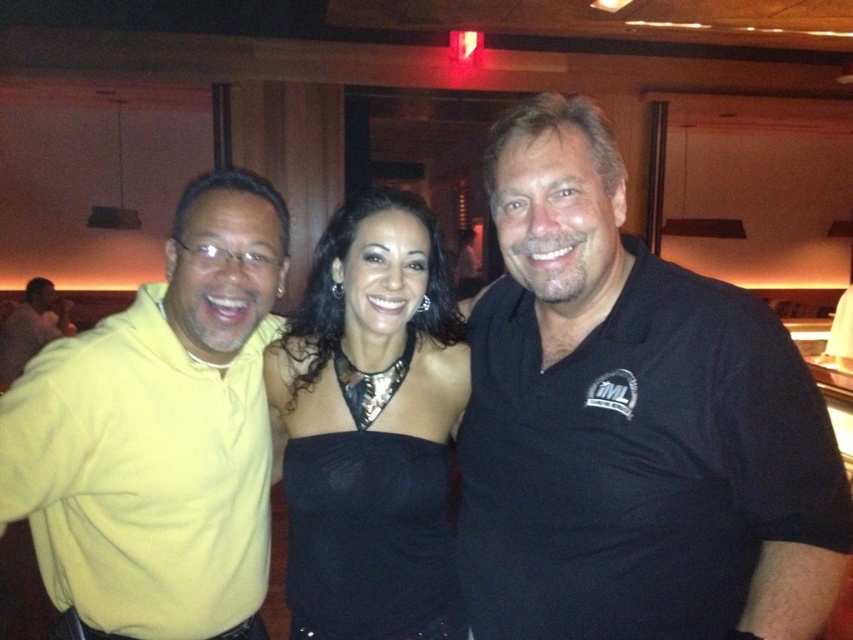
Question: Can you confirm if yellow matte hoodie at left is positioned to the right of yellow matte shirt at left?

Choices:
 (A) yes
 (B) no

Answer: (A)

Question: Is black cotton shirt at right closer to camera compared to yellow matte hoodie at left?

Choices:
 (A) yes
 (B) no

Answer: (A)

Question: Which object appears farthest from the camera in this image?

Choices:
 (A) yellow matte hoodie at left
 (B) yellow matte shirt at left

Answer: (B)

Question: Is black cotton shirt at right to the left of yellow matte shirt at left from the viewer's perspective?

Choices:
 (A) no
 (B) yes

Answer: (A)

Question: Which of these objects is positioned farthest from the black satin dress at center?

Choices:
 (A) yellow matte hoodie at left
 (B) black cotton shirt at right
 (C) yellow matte shirt at left

Answer: (C)

Question: Among these objects, which one is nearest to the camera?

Choices:
 (A) yellow matte hoodie at left
 (B) black cotton shirt at right
 (C) yellow matte shirt at left
 (D) black satin dress at center

Answer: (B)